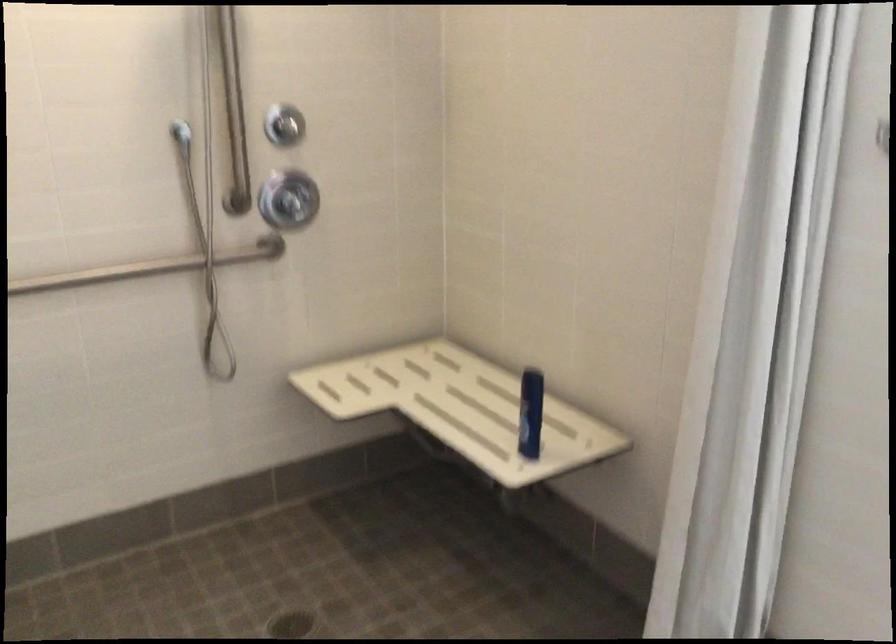
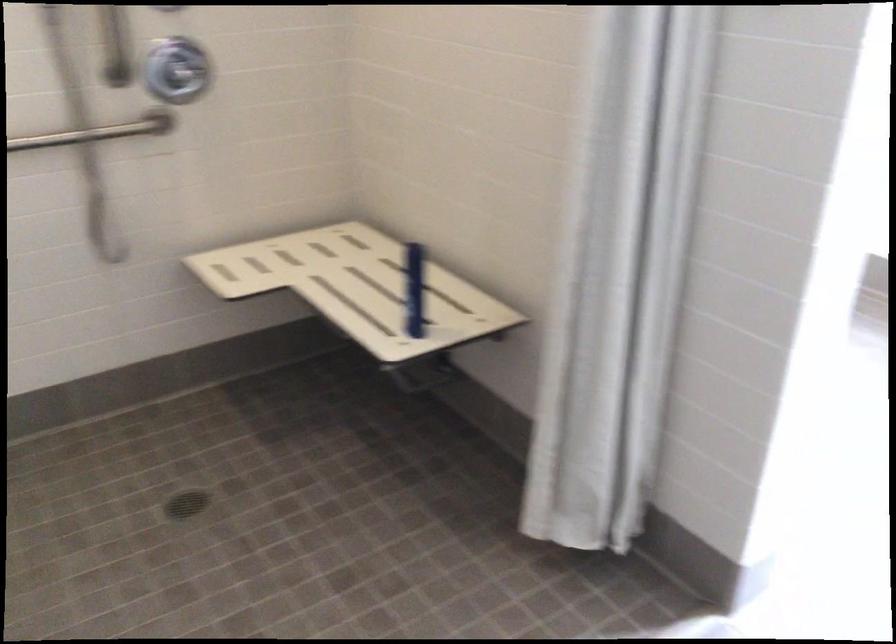
Find the pixel in the second image that matches (458,408) in the first image.

(357, 287)